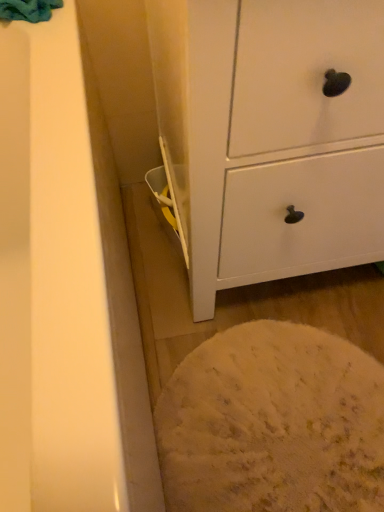
Question: Relative to teal soft towel at upper left, is white matte chest of drawers at center in front or behind?

Choices:
 (A) behind
 (B) front

Answer: (B)

Question: Is point (372, 129) closer or farther from the camera than point (13, 18)?

Choices:
 (A) farther
 (B) closer

Answer: (B)

Question: From a real-world perspective, is white matte chest of drawers at center physically located above or below teal soft towel at upper left?

Choices:
 (A) above
 (B) below

Answer: (B)

Question: From a real-world perspective, is teal soft towel at upper left positioned above or below white matte chest of drawers at center?

Choices:
 (A) below
 (B) above

Answer: (B)

Question: In terms of size, does teal soft towel at upper left appear bigger or smaller than white matte chest of drawers at center?

Choices:
 (A) big
 (B) small

Answer: (B)

Question: Visually, is teal soft towel at upper left positioned to the left or to the right of white matte chest of drawers at center?

Choices:
 (A) right
 (B) left

Answer: (B)

Question: Considering their positions, is teal soft towel at upper left located in front of or behind white matte chest of drawers at center?

Choices:
 (A) front
 (B) behind

Answer: (B)